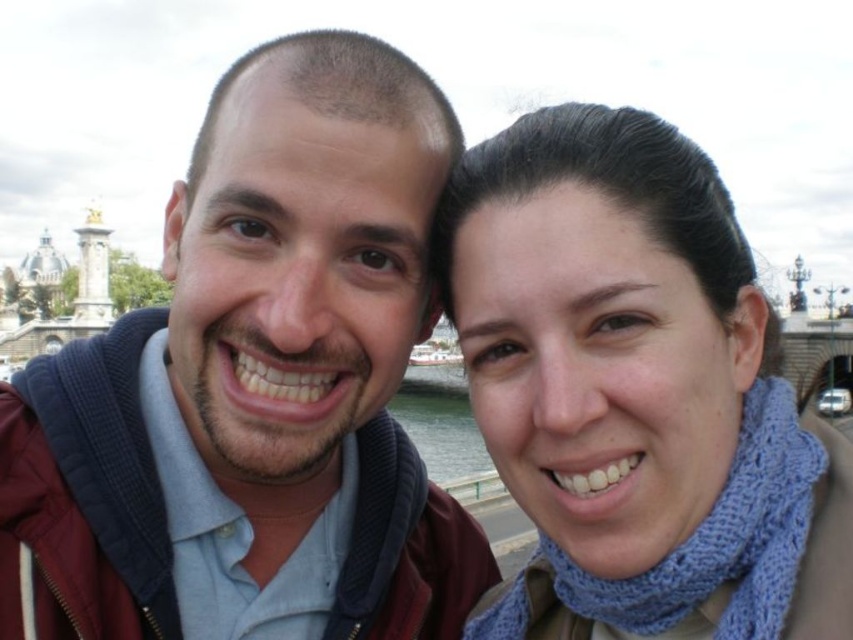
You are a photographer trying to capture a photo of the clear water at lower center and the blue knitted scarf at upper right. Which object is located to the right of the other?

The blue knitted scarf at upper right is positioned on the right side of clear water at lower center.

You are using a camera to take a photo of the scene. The camera has a rectangular frame that can only capture objects within a specific area. The frame is positioned such that its top edge is at y < 0.7. Will the blue knitted scarf at upper right be fully visible inside the camera frame?

The blue knitted scarf at upper right is located at point y coordinate 0.744, which is above the camera frame top edge at y < 0.7. Therefore, the blue knitted scarf at upper right will not be fully visible inside the camera frame.